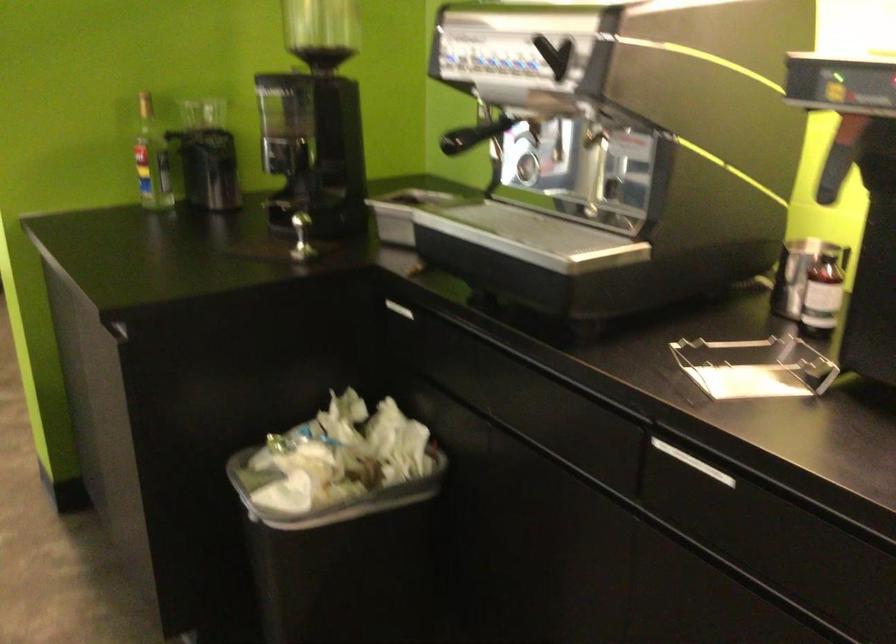
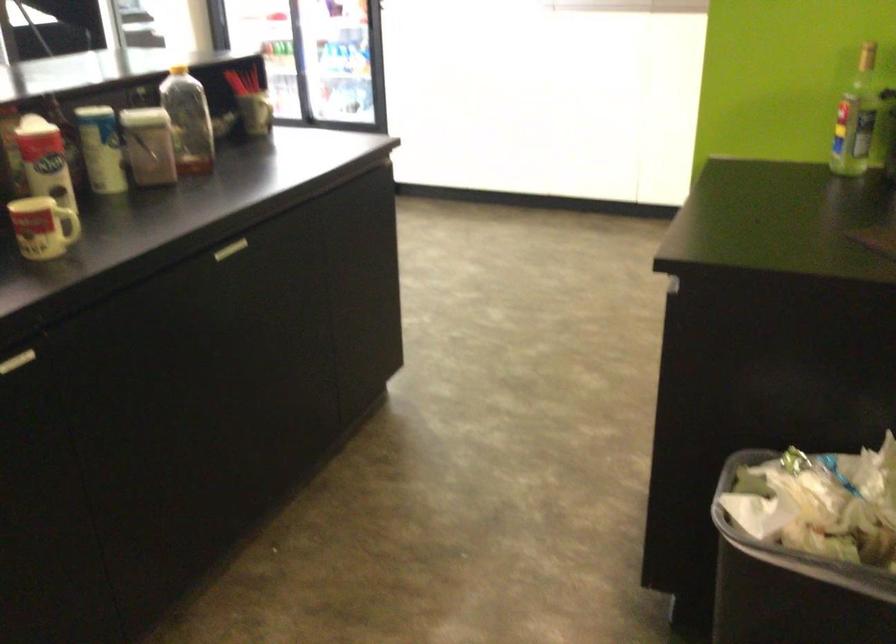
Find the pixel in the second image that matches [177,169] in the first image.

(856, 118)